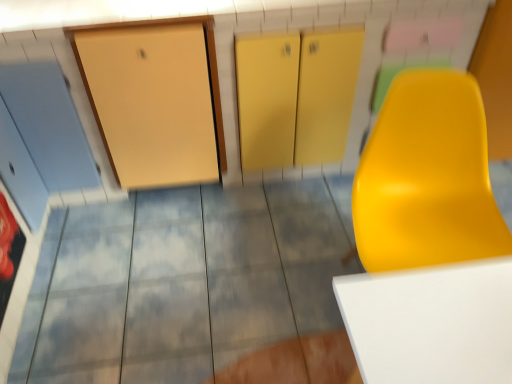
Question: Is matte yellow chair at right inside the boundaries of matte yellow tile at center, or outside?

Choices:
 (A) outside
 (B) inside

Answer: (A)

Question: From the image's perspective, is matte yellow chair at right above or below matte yellow tile at center?

Choices:
 (A) below
 (B) above

Answer: (B)

Question: Considering the positions of matte yellow chair at right and matte yellow tile at center in the image, is matte yellow chair at right bigger or smaller than matte yellow tile at center?

Choices:
 (A) big
 (B) small

Answer: (B)

Question: Looking at the image, does matte yellow tile at center seem bigger or smaller compared to matte yellow chair at right?

Choices:
 (A) big
 (B) small

Answer: (A)

Question: Visually, is matte yellow tile at center positioned to the left or to the right of matte yellow chair at right?

Choices:
 (A) right
 (B) left

Answer: (B)

Question: From the image's perspective, is matte yellow tile at center above or below matte yellow chair at right?

Choices:
 (A) below
 (B) above

Answer: (A)

Question: In terms of height, does matte yellow tile at center look taller or shorter compared to matte yellow chair at right?

Choices:
 (A) short
 (B) tall

Answer: (A)